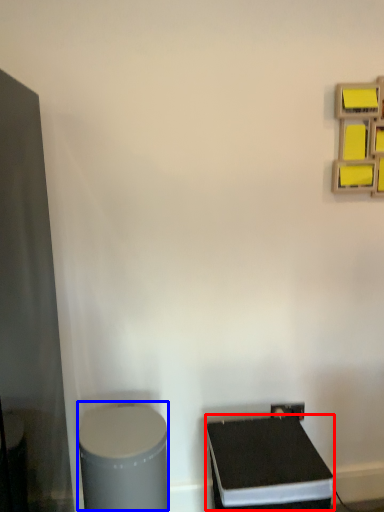
Question: Which of the following is the farthest to the observer, wide (highlighted by a red box) or wide (highlighted by a blue box)?

Choices:
 (A) wide
 (B) wide

Answer: (A)